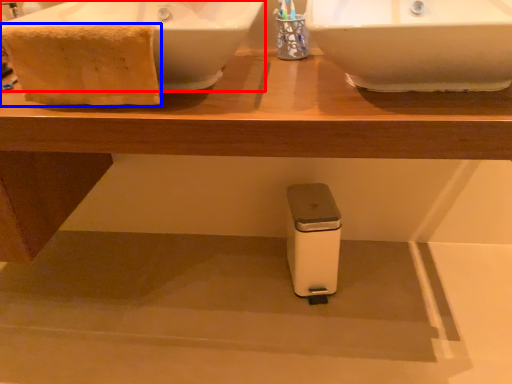
Question: Which point is closer to the camera, sink (highlighted by a red box) or material (highlighted by a blue box)?

Choices:
 (A) sink
 (B) material

Answer: (A)